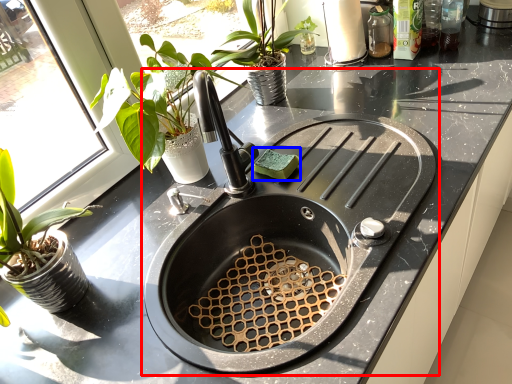
Question: Which point is further to the camera, sink (highlighted by a red box) or food (highlighted by a blue box)?

Choices:
 (A) sink
 (B) food

Answer: (B)